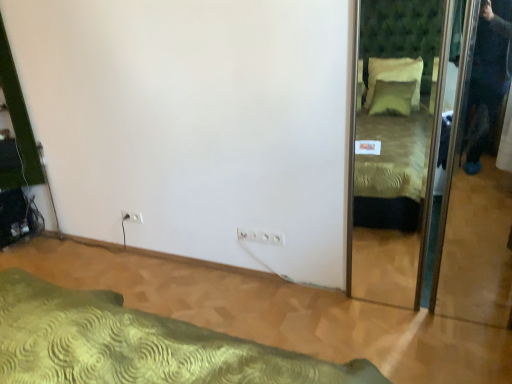
From the picture: How much space does white plastic electric outlet at lower left, marked as the 2th electric outlet in a bottom-to-top arrangement, occupy vertically?

A: The height of white plastic electric outlet at lower left, marked as the 2th electric outlet in a bottom-to-top arrangement, is 11.54 centimeters.

What do you see at coordinates (132, 217) in the screenshot? The width and height of the screenshot is (512, 384). I see `white plastic electric outlet at lower left, positioned as the 1th electric outlet in top-to-bottom order` at bounding box center [132, 217].

Identify the location of green textured mirror at right. This screenshot has height=384, width=512. (394, 174).

You are a GUI agent. You are given a task and a screenshot of the screen. Output one action in this format:
    pyautogui.click(x=<x>, y=<y>)
    Task: Click on the white plastic electric outlet at center, which ranks as the 1th electric outlet in right-to-left order
    This screenshot has width=512, height=384.
    Given the screenshot: What is the action you would take?
    pyautogui.click(x=260, y=236)

Is green textured bed at lower left oriented towards white plastic electric outlet at center, acting as the first electric outlet starting from the front?

No.

Is green textured bed at lower left taller or shorter than white plastic electric outlet at center, which is counted as the 2th electric outlet, starting from the back?

In the image, green textured bed at lower left appears to be shorter than white plastic electric outlet at center, which is counted as the 2th electric outlet, starting from the back.

Based on the photo, could you tell me if green textured bed at lower left is facing green textured mirror at right?

No, green textured bed at lower left does not turn towards green textured mirror at right.

Which is in front, green textured bed at lower left or green textured mirror at right?

green textured mirror at right is closer to the camera.

Which point is more distant from viewer, (127,355) or (405,282)?

The point (405,282) is farther.

From a real-world perspective, is green textured bed at lower left located beneath green textured mirror at right?

Yes, from a real-world perspective, green textured bed at lower left is below green textured mirror at right.

Is green textured mirror at right in front of or behind green textured bed at lower left in the image?

Clearly, green textured mirror at right is in front of green textured bed at lower left.

From a real-world perspective, is green textured mirror at right physically located above or below green textured bed at lower left?

In terms of real-world spatial position, green textured mirror at right is above green textured bed at lower left.

In the scene shown: Which of these two, green textured mirror at right or green textured bed at lower left, is thinner?

green textured mirror at right is thinner.

Is green textured mirror at right aimed at green textured bed at lower left?

No.

Based on their sizes in the image, would you say green textured mirror at right is bigger or smaller than white plastic electric outlet at center, which is the second electric outlet in top-to-bottom order?

In the image, green textured mirror at right appears to be larger than white plastic electric outlet at center, which is the second electric outlet in top-to-bottom order.

Can you confirm if green textured mirror at right is positioned to the left of white plastic electric outlet at center, which is the 1th electric outlet in bottom-to-top order?

In fact, green textured mirror at right is to the right of white plastic electric outlet at center, which is the 1th electric outlet in bottom-to-top order.

Is green textured mirror at right situated inside white plastic electric outlet at center, which is the 1th electric outlet in bottom-to-top order, or outside?

green textured mirror at right is not enclosed by white plastic electric outlet at center, which is the 1th electric outlet in bottom-to-top order.

From the image's perspective, does white plastic electric outlet at center, which ranks as the 2th electric outlet in left-to-right order, appear higher than green textured mirror at right?

No, from the image's perspective, white plastic electric outlet at center, which ranks as the 2th electric outlet in left-to-right order, is not over green textured mirror at right.

Is point (257, 239) closer or farther from the camera than point (415, 302)?

Clearly, point (257, 239) is more distant from the camera than point (415, 302).

In the scene shown: Is white plastic electric outlet at center, acting as the first electric outlet starting from the front, surrounding green textured mirror at right?

No, green textured mirror at right is not a part of white plastic electric outlet at center, acting as the first electric outlet starting from the front.

Locate an element on the screen. Image resolution: width=512 pixels, height=384 pixels. electric outlet that is the 1st object located behind the green textured mirror at right is located at coordinates (260, 236).

Locate an element on the screen. The image size is (512, 384). electric outlet to the right of white plastic electric outlet at lower left, arranged as the second electric outlet when viewed from the front is located at coordinates (260, 236).

Who is taller, white plastic electric outlet at center, which ranks as the 1th electric outlet in right-to-left order, or white plastic electric outlet at lower left, the 1th electric outlet from the back?

white plastic electric outlet at center, which ranks as the 1th electric outlet in right-to-left order, is taller.

From the image's perspective, between white plastic electric outlet at center, which ranks as the 1th electric outlet in right-to-left order, and white plastic electric outlet at lower left, the 1th electric outlet from the back, who is located below?

From the image's view, white plastic electric outlet at center, which ranks as the 1th electric outlet in right-to-left order, is below.

Does white plastic electric outlet at center, which is counted as the 2th electric outlet, starting from the back, have a larger size compared to white plastic electric outlet at lower left, the 1th electric outlet from the back?

→ Yes, white plastic electric outlet at center, which is counted as the 2th electric outlet, starting from the back, is bigger than white plastic electric outlet at lower left, the 1th electric outlet from the back.

Is white plastic electric outlet at lower left, arranged as the second electric outlet when viewed from the front, aimed at white plastic electric outlet at center, which is the 1th electric outlet in bottom-to-top order?

No, white plastic electric outlet at lower left, arranged as the second electric outlet when viewed from the front, is not oriented towards white plastic electric outlet at center, which is the 1th electric outlet in bottom-to-top order.

Considering the sizes of white plastic electric outlet at lower left, marked as the 2th electric outlet in a bottom-to-top arrangement, and white plastic electric outlet at center, which is counted as the 2th electric outlet, starting from the back, in the image, is white plastic electric outlet at lower left, marked as the 2th electric outlet in a bottom-to-top arrangement, taller or shorter than white plastic electric outlet at center, which is counted as the 2th electric outlet, starting from the back,?

Clearly, white plastic electric outlet at lower left, marked as the 2th electric outlet in a bottom-to-top arrangement, is shorter compared to white plastic electric outlet at center, which is counted as the 2th electric outlet, starting from the back.

Is white plastic electric outlet at lower left, marked as the 2th electric outlet in a right-to-left arrangement, not within white plastic electric outlet at center, which is the second electric outlet in top-to-bottom order?

Indeed, white plastic electric outlet at lower left, marked as the 2th electric outlet in a right-to-left arrangement, is completely outside white plastic electric outlet at center, which is the second electric outlet in top-to-bottom order.

Locate an element on the screen. Image resolution: width=512 pixels, height=384 pixels. the 1st electric outlet behind the green textured bed at lower left, starting your count from the anchor is located at coordinates (260, 236).

This screenshot has width=512, height=384. I want to click on mirror above the green textured bed at lower left (from a real-world perspective), so click(394, 174).

When comparing their distances from green textured mirror at right, does white plastic electric outlet at lower left, arranged as the second electric outlet when viewed from the front, or green textured bed at lower left seem further?

Based on the image, white plastic electric outlet at lower left, arranged as the second electric outlet when viewed from the front, appears to be further to green textured mirror at right.

When comparing their distances from white plastic electric outlet at center, which is counted as the 2th electric outlet, starting from the back, does green textured bed at lower left or white plastic electric outlet at lower left, positioned as the 1th electric outlet in top-to-bottom order, seem further?

green textured bed at lower left is further to white plastic electric outlet at center, which is counted as the 2th electric outlet, starting from the back.

When comparing their distances from green textured bed at lower left, does green textured mirror at right or white plastic electric outlet at lower left, the 1th electric outlet from the back, seem further?

green textured mirror at right is positioned further to the anchor green textured bed at lower left.

From the image, which object appears to be farther from white plastic electric outlet at center, which is the second electric outlet in top-to-bottom order, white plastic electric outlet at lower left, positioned as the 1th electric outlet in top-to-bottom order, or green textured mirror at right?

green textured mirror at right is further to white plastic electric outlet at center, which is the second electric outlet in top-to-bottom order.

Looking at the image, which one is located closer to white plastic electric outlet at center, which ranks as the 2th electric outlet in left-to-right order, green textured bed at lower left or green textured mirror at right?

The object closer to white plastic electric outlet at center, which ranks as the 2th electric outlet in left-to-right order, is green textured mirror at right.

Estimate the real-world distances between objects in this image. Which object is closer to white plastic electric outlet at center, which is the second electric outlet in top-to-bottom order, green textured mirror at right or white plastic electric outlet at lower left, marked as the 2th electric outlet in a bottom-to-top arrangement?

white plastic electric outlet at lower left, marked as the 2th electric outlet in a bottom-to-top arrangement, is positioned closer to the anchor white plastic electric outlet at center, which is the second electric outlet in top-to-bottom order.

From the image, which object appears to be nearer to white plastic electric outlet at center, which is the 1th electric outlet in bottom-to-top order, white plastic electric outlet at lower left, the 1th electric outlet from the back, or green textured bed at lower left?

white plastic electric outlet at lower left, the 1th electric outlet from the back.

Which object lies nearer to the anchor point white plastic electric outlet at lower left, positioned as the 1th electric outlet in top-to-bottom order, white plastic electric outlet at center, which is the second electric outlet in top-to-bottom order, or green textured bed at lower left?

white plastic electric outlet at center, which is the second electric outlet in top-to-bottom order.

Identify the location of electric outlet situated between white plastic electric outlet at lower left, positioned as the 1th electric outlet in top-to-bottom order, and green textured mirror at right from left to right. This screenshot has height=384, width=512. (260, 236).

Locate an element on the screen. The width and height of the screenshot is (512, 384). electric outlet situated between green textured bed at lower left and green textured mirror at right from left to right is located at coordinates coord(260,236).

Locate an element on the screen. Image resolution: width=512 pixels, height=384 pixels. bed between white plastic electric outlet at lower left, the 1th electric outlet when ordered from left to right, and green textured mirror at right from left to right is located at coordinates [136, 344].

Image resolution: width=512 pixels, height=384 pixels. I want to click on electric outlet located between green textured bed at lower left and white plastic electric outlet at lower left, the 1th electric outlet from the back, in the depth direction, so click(x=260, y=236).